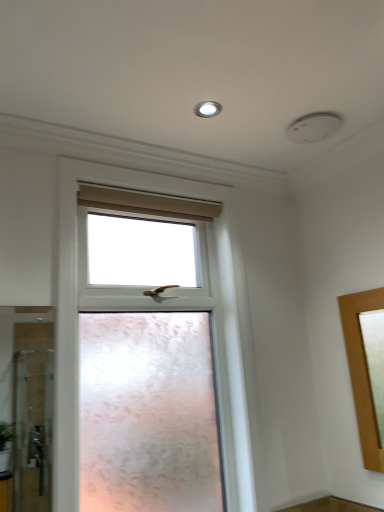
Question: Is white glossy light fixture at upper center to the left or to the right of clear glass window at center in the image?

Choices:
 (A) left
 (B) right

Answer: (B)

Question: In terms of height, does white glossy light fixture at upper center look taller or shorter compared to clear glass window at center?

Choices:
 (A) tall
 (B) short

Answer: (B)

Question: Considering the positions of point (196, 108) and point (215, 259), is point (196, 108) closer or farther from the camera than point (215, 259)?

Choices:
 (A) farther
 (B) closer

Answer: (B)

Question: Considering the positions of point (243, 419) and point (213, 114), is point (243, 419) closer or farther from the camera than point (213, 114)?

Choices:
 (A) farther
 (B) closer

Answer: (A)

Question: From a real-world perspective, relative to white glossy light fixture at upper center, is clear glass window at center vertically above or below?

Choices:
 (A) below
 (B) above

Answer: (A)

Question: Relative to white glossy light fixture at upper center, is clear glass window at center in front or behind?

Choices:
 (A) behind
 (B) front

Answer: (B)

Question: In terms of width, does clear glass window at center look wider or thinner when compared to white glossy light fixture at upper center?

Choices:
 (A) wide
 (B) thin

Answer: (A)